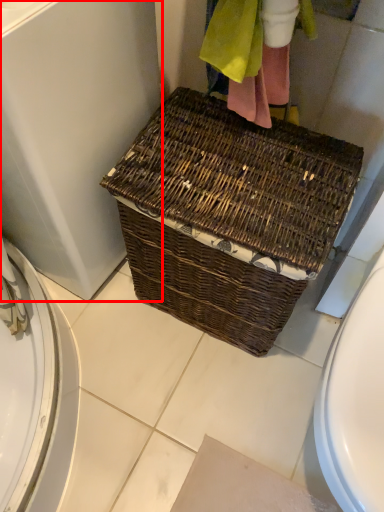
Question: Considering the relative positions of screen door (annotated by the red box) and picnic basket in the image provided, where is screen door (annotated by the red box) located with respect to the staircase?

Choices:
 (A) left
 (B) right

Answer: (A)